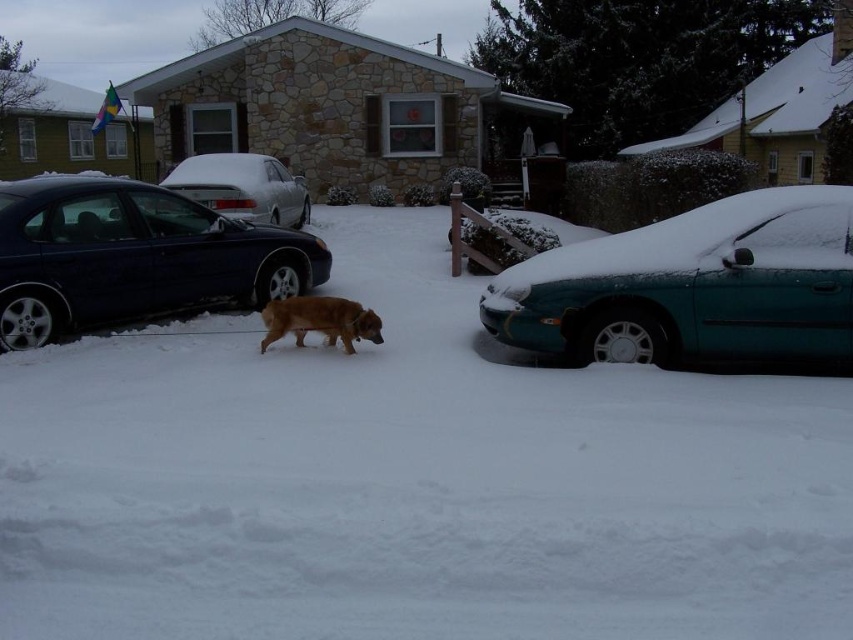
Question: Is white fluffy snow at center bigger than fuzzy brown dog at center?

Choices:
 (A) no
 (B) yes

Answer: (B)

Question: Which point is closer to the camera?

Choices:
 (A) shiny blue sedan at left
 (B) teal glossy sedan at right
 (C) white fluffy snow at center

Answer: (C)

Question: Based on their relative distances, which object is nearer to the teal glossy sedan at right?

Choices:
 (A) white glossy sedan at center
 (B) fuzzy brown dog at center
 (C) shiny blue sedan at left

Answer: (B)

Question: Considering the relative positions of white fluffy snow at center and shiny blue sedan at left in the image provided, where is white fluffy snow at center located with respect to shiny blue sedan at left?

Choices:
 (A) right
 (B) left

Answer: (A)

Question: Which point is farther to the camera?

Choices:
 (A) fuzzy brown dog at center
 (B) teal glossy sedan at right
 (C) white fluffy snow at center

Answer: (A)

Question: Does white fluffy snow at center appear over white glossy sedan at center?

Choices:
 (A) no
 (B) yes

Answer: (A)